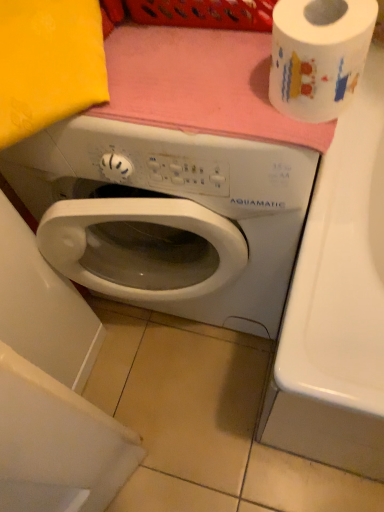
Question: Is white glossy washing machine at center smaller than white glossy toilet paper at upper right?

Choices:
 (A) no
 (B) yes

Answer: (A)

Question: Does white glossy washing machine at center have a lesser width compared to white glossy toilet paper at upper right?

Choices:
 (A) yes
 (B) no

Answer: (B)

Question: Is white glossy toilet paper at upper right located within white glossy washing machine at center?

Choices:
 (A) no
 (B) yes

Answer: (A)

Question: From a real-world perspective, is white glossy washing machine at center located beneath white glossy toilet paper at upper right?

Choices:
 (A) yes
 (B) no

Answer: (A)

Question: Is white glossy washing machine at center in front of white glossy toilet paper at upper right?

Choices:
 (A) no
 (B) yes

Answer: (A)

Question: Is white glossy washing machine at center completely or partially outside of white glossy toilet paper at upper right?

Choices:
 (A) yes
 (B) no

Answer: (A)

Question: Does white glossy toilet paper at upper right have a greater width compared to white glossy washing machine at center?

Choices:
 (A) yes
 (B) no

Answer: (B)

Question: Is white glossy toilet paper at upper right facing away from white glossy washing machine at center?

Choices:
 (A) yes
 (B) no

Answer: (B)

Question: Is the surface of white glossy toilet paper at upper right in direct contact with white glossy washing machine at center?

Choices:
 (A) yes
 (B) no

Answer: (B)

Question: Is white glossy toilet paper at upper right shorter than white glossy washing machine at center?

Choices:
 (A) yes
 (B) no

Answer: (A)

Question: From the image's perspective, is white glossy toilet paper at upper right under white glossy washing machine at center?

Choices:
 (A) yes
 (B) no

Answer: (B)

Question: From the image's perspective, is white glossy toilet paper at upper right over white glossy washing machine at center?

Choices:
 (A) no
 (B) yes

Answer: (B)

Question: From a real-world perspective, is white glossy toilet paper at upper right positioned above or below white glossy washing machine at center?

Choices:
 (A) above
 (B) below

Answer: (A)